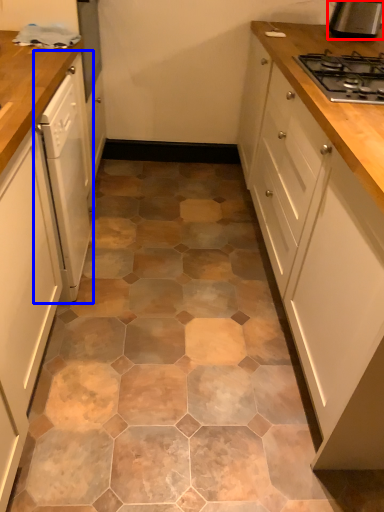
Question: Which object is closer to the camera taking this photo, kitchen appliance (highlighted by a red box) or home appliance (highlighted by a blue box)?

Choices:
 (A) kitchen appliance
 (B) home appliance

Answer: (B)